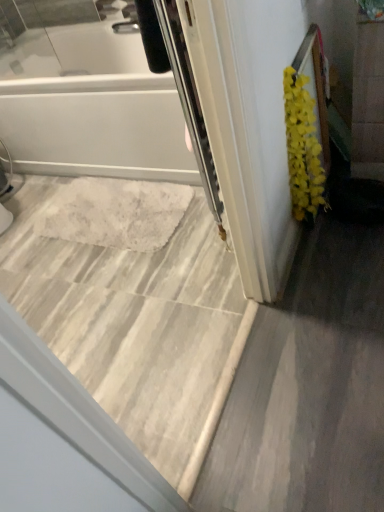
Question: From a real-world perspective, is marble tile floor at center positioned under yellow fluffy plant at right based on gravity?

Choices:
 (A) no
 (B) yes

Answer: (B)

Question: Considering the relative sizes of marble tile floor at center and yellow fluffy plant at right in the image provided, is marble tile floor at center thinner than yellow fluffy plant at right?

Choices:
 (A) yes
 (B) no

Answer: (B)

Question: Is the depth of marble tile floor at center less than that of yellow fluffy plant at right?

Choices:
 (A) no
 (B) yes

Answer: (B)

Question: Is marble tile floor at center taller than yellow fluffy plant at right?

Choices:
 (A) yes
 (B) no

Answer: (B)

Question: Is the depth of marble tile floor at center greater than that of yellow fluffy plant at right?

Choices:
 (A) yes
 (B) no

Answer: (B)

Question: Is marble tile floor at center bigger or smaller than white glossy bathtub at upper left?

Choices:
 (A) small
 (B) big

Answer: (B)

Question: Is marble tile floor at center situated inside white glossy bathtub at upper left or outside?

Choices:
 (A) outside
 (B) inside

Answer: (A)

Question: From the image's perspective, is marble tile floor at center above or below white glossy bathtub at upper left?

Choices:
 (A) below
 (B) above

Answer: (A)

Question: Is point (115, 206) positioned closer to the camera than point (135, 175)?

Choices:
 (A) closer
 (B) farther

Answer: (A)

Question: Is yellow fluffy plant at right inside the boundaries of marble tile floor at center, or outside?

Choices:
 (A) inside
 (B) outside

Answer: (B)

Question: Looking at their shapes, would you say yellow fluffy plant at right is wider or thinner than marble tile floor at center?

Choices:
 (A) wide
 (B) thin

Answer: (B)

Question: From a real-world perspective, is yellow fluffy plant at right positioned above or below marble tile floor at center?

Choices:
 (A) above
 (B) below

Answer: (A)

Question: From the image's perspective, is yellow fluffy plant at right located above or below marble tile floor at center?

Choices:
 (A) below
 (B) above

Answer: (B)

Question: Considering their positions, is white glossy bathtub at upper left located in front of or behind marble tile floor at center?

Choices:
 (A) front
 (B) behind

Answer: (A)

Question: Is point (82, 32) positioned closer to the camera than point (157, 418)?

Choices:
 (A) closer
 (B) farther

Answer: (B)